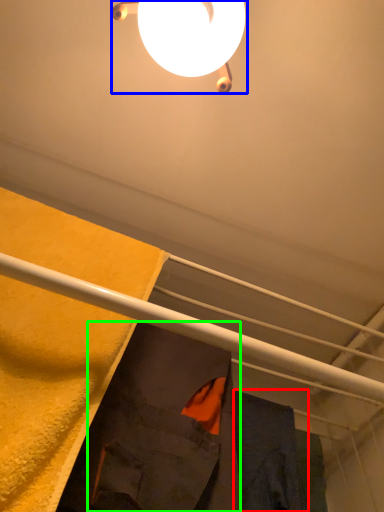
Question: Which is farther away from robe (highlighted by a red box)? lamp (highlighted by a blue box) or robe (highlighted by a green box)?

Choices:
 (A) lamp
 (B) robe

Answer: (A)